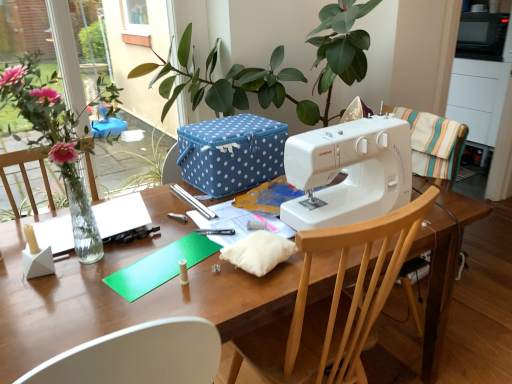
This screenshot has height=384, width=512. What are the coordinates of `empty space that is to the right of green leafy plant at left` in the screenshot? It's located at tap(193, 244).